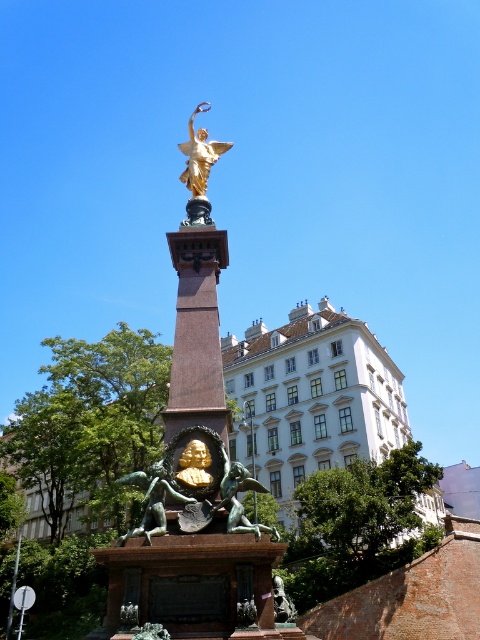
Question: From the image, what is the correct spatial relationship of gold polished statue at center in relation to bronze/green patina statue at center?

Choices:
 (A) right
 (B) left

Answer: (B)

Question: Which object appears farthest from the camera in this image?

Choices:
 (A) gold polished statue at center
 (B) bronze statue at center

Answer: (B)

Question: Is bronze/green patina statue at center to the left of bronze statue at center from the viewer's perspective?

Choices:
 (A) yes
 (B) no

Answer: (A)

Question: Does gold polished statue at center have a smaller size compared to bronze/green patina statue at center?

Choices:
 (A) no
 (B) yes

Answer: (A)

Question: Which point is farther to the camera?

Choices:
 (A) (152, 568)
 (B) (154, 486)
 (C) (220, 506)

Answer: (B)

Question: Among these points, which one is nearest to the camera?

Choices:
 (A) (188, 451)
 (B) (137, 474)
 (C) (228, 486)

Answer: (C)